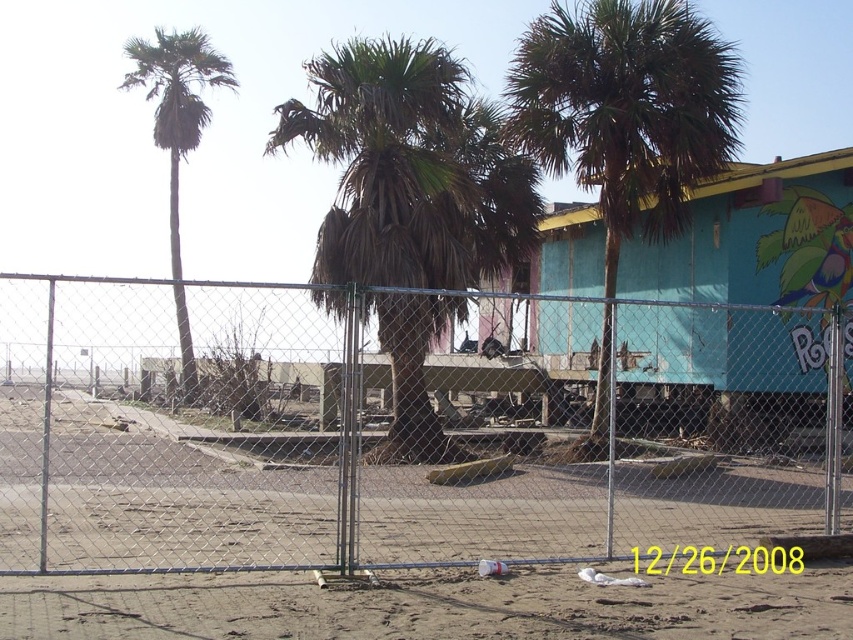
Is point (410, 116) more distant than point (564, 305)?

No, (410, 116) is closer to viewer.

Where is `brown textured palm tree at center`? The height and width of the screenshot is (640, 853). brown textured palm tree at center is located at coordinates (410, 168).

Is metal chain-link fence at center behind green leafy palm tree at left?

No, metal chain-link fence at center is closer to the viewer.

Can you confirm if metal chain-link fence at center is positioned to the left of green leafy palm tree at left?

Incorrect, metal chain-link fence at center is not on the left side of green leafy palm tree at left.

Which is behind, point (601, 504) or point (196, 32)?

Point (196, 32)

Where is `metal chain-link fence at center`? Image resolution: width=853 pixels, height=640 pixels. metal chain-link fence at center is located at coordinates (401, 429).

Is teal painted wood cabin at center thinner than green leafy palm tree at left?

Yes.

The width and height of the screenshot is (853, 640). In order to click on teal painted wood cabin at center in this screenshot , I will do `click(755, 237)`.

Where is `teal painted wood cabin at center`? teal painted wood cabin at center is located at coordinates (755, 237).